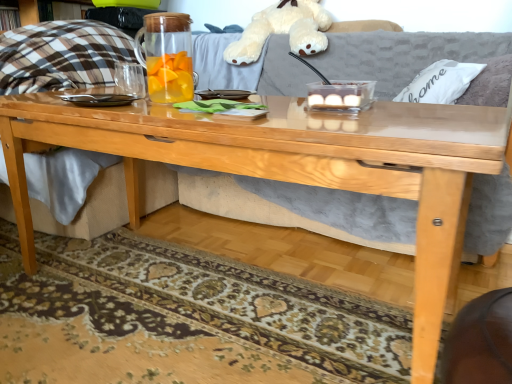
Question: From a real-world perspective, is white plush toy at upper center above or below transparent glass pitcher at center?

Choices:
 (A) below
 (B) above

Answer: (B)

Question: From the image's perspective, is white plush toy at upper center located above or below transparent glass pitcher at center?

Choices:
 (A) below
 (B) above

Answer: (B)

Question: Estimate the real-world distances between objects in this image. Which object is closer to the white plush toy at upper center?

Choices:
 (A) transparent glass pitcher at center
 (B) patterned carpet at lower center
 (C) white fabric pillow at upper right

Answer: (C)

Question: Which of these objects is positioned closest to the patterned carpet at lower center?

Choices:
 (A) transparent glass pitcher at center
 (B) white plush toy at upper center
 (C) white fabric pillow at upper right

Answer: (A)